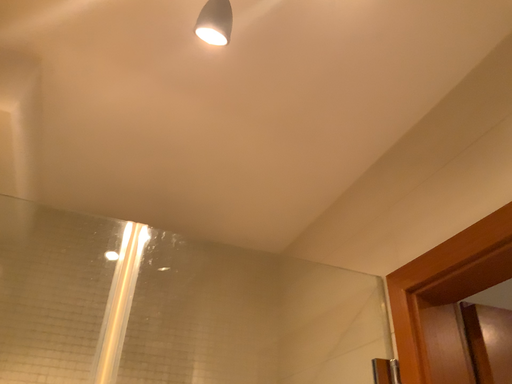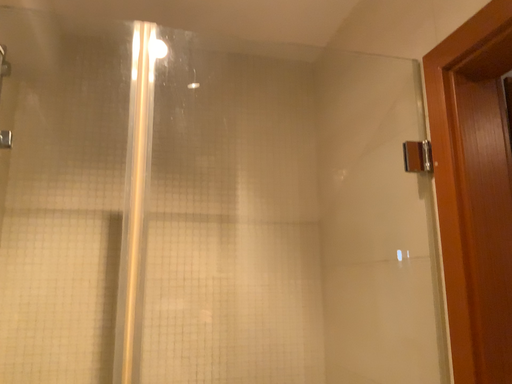
Question: How did the camera likely rotate when shooting the video?

Choices:
 (A) rotated upward
 (B) rotated downward

Answer: (B)